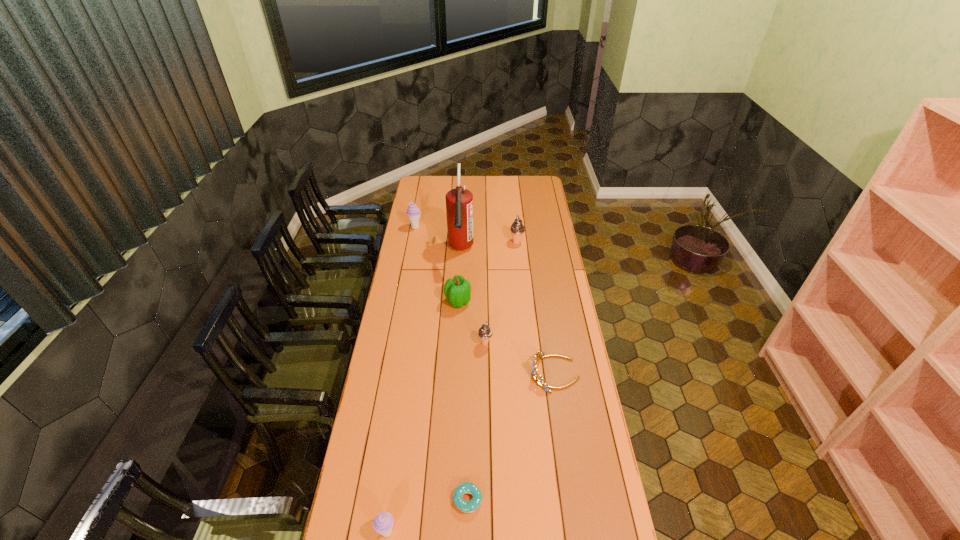
The width and height of the screenshot is (960, 540). Find the location of `the sixth farthest object`. the sixth farthest object is located at coordinates (540, 381).

Locate an element on the screen. This screenshot has height=540, width=960. gold tiara is located at coordinates (540, 381).

Find the location of a particular element. the seventh farthest object is located at coordinates (472, 505).

Where is `the shortest object`? The width and height of the screenshot is (960, 540). the shortest object is located at coordinates coord(472,505).

The height and width of the screenshot is (540, 960). What are the coordinates of `free space located at the nozzle of the fire extinguisher` in the screenshot? It's located at (457, 323).

Where is `vacant space located on the front of the farther chocolate icecream`? vacant space located on the front of the farther chocolate icecream is located at coordinates (519, 266).

Where is `vacant area situated on the front of the farthest icecream`? Image resolution: width=960 pixels, height=540 pixels. vacant area situated on the front of the farthest icecream is located at coordinates (408, 263).

Identify the location of free space located 0.080m on the right of the bell pepper. (489, 301).

Where is `free region located 0.050m on the front of the second nearest icecream`? free region located 0.050m on the front of the second nearest icecream is located at coordinates (486, 358).

Find the location of a particular element. This screenshot has height=540, width=960. free spot located on the front-facing side of the sixth farthest object is located at coordinates (509, 374).